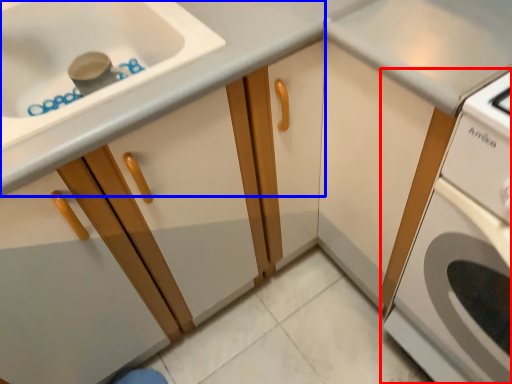
Question: Among these objects, which one is farthest to the camera, home appliance (highlighted by a red box) or cabinetry (highlighted by a blue box)?

Choices:
 (A) home appliance
 (B) cabinetry

Answer: (B)